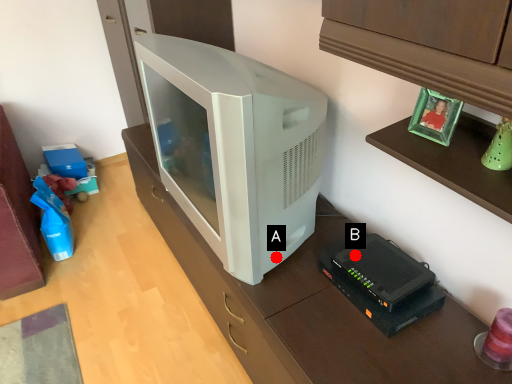
Question: Two points are circled on the image, labeled by A and B beside each circle. Which point is closer to the camera taking this photo?

Choices:
 (A) A is closer
 (B) B is closer

Answer: (B)